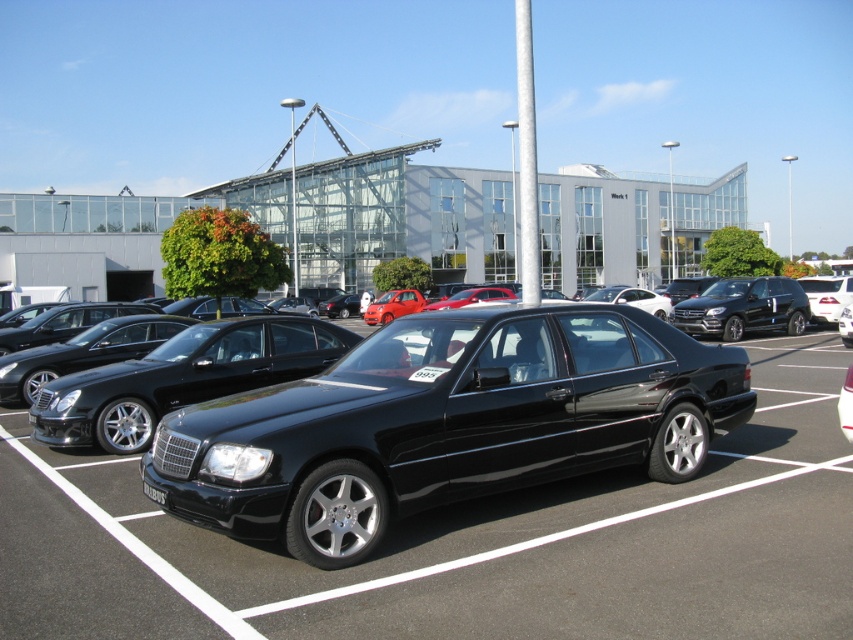
Question: Does black metallic sedan at right have a larger size compared to black plastic license plate at center?

Choices:
 (A) no
 (B) yes

Answer: (B)

Question: Is glossy black car at center above black metallic sedan at right?

Choices:
 (A) yes
 (B) no

Answer: (B)

Question: Which of the following is the closest to the observer?

Choices:
 (A) glossy black car at center
 (B) black plastic license plate at center
 (C) black metallic sedan at right

Answer: (A)

Question: Based on their relative distances, which object is nearer to the black plastic license plate at center?

Choices:
 (A) black metallic sedan at right
 (B) glossy black car at center

Answer: (B)

Question: Which point is farther to the camera?

Choices:
 (A) (624, 531)
 (B) (148, 483)
 (C) (804, 321)

Answer: (C)

Question: Is glossy black car at center smaller than black plastic license plate at center?

Choices:
 (A) no
 (B) yes

Answer: (A)